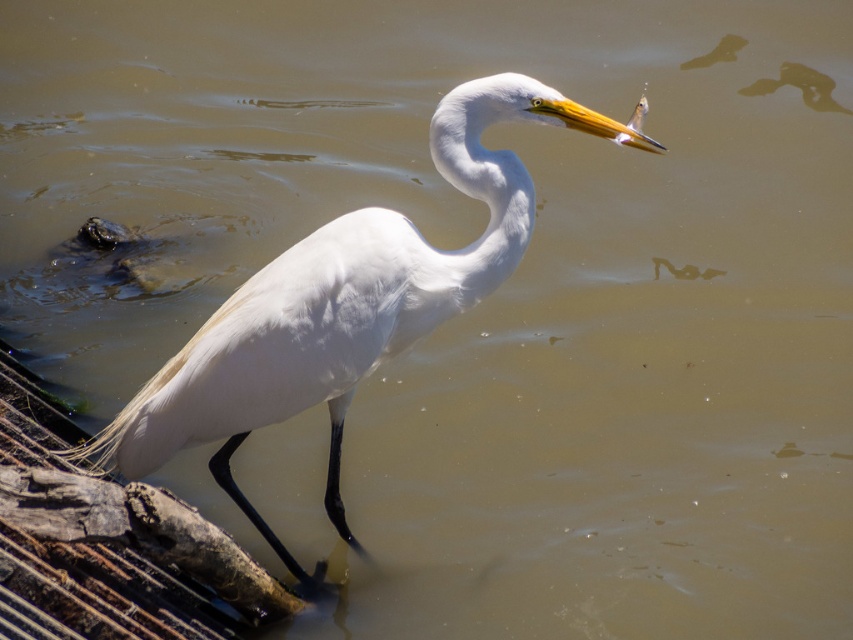
Question: Which of the following is the farthest from the observer?

Choices:
 (A) white feathered bird at center
 (B) white smooth neck at center

Answer: (B)

Question: Does white feathered bird at center appear on the right side of white smooth neck at center?

Choices:
 (A) no
 (B) yes

Answer: (A)

Question: Can you confirm if white feathered bird at center is thinner than white smooth neck at center?

Choices:
 (A) yes
 (B) no

Answer: (B)

Question: Is white feathered bird at center smaller than white smooth neck at center?

Choices:
 (A) no
 (B) yes

Answer: (A)

Question: Which of the following is the farthest from the observer?

Choices:
 (A) (345, 385)
 (B) (451, 145)

Answer: (A)